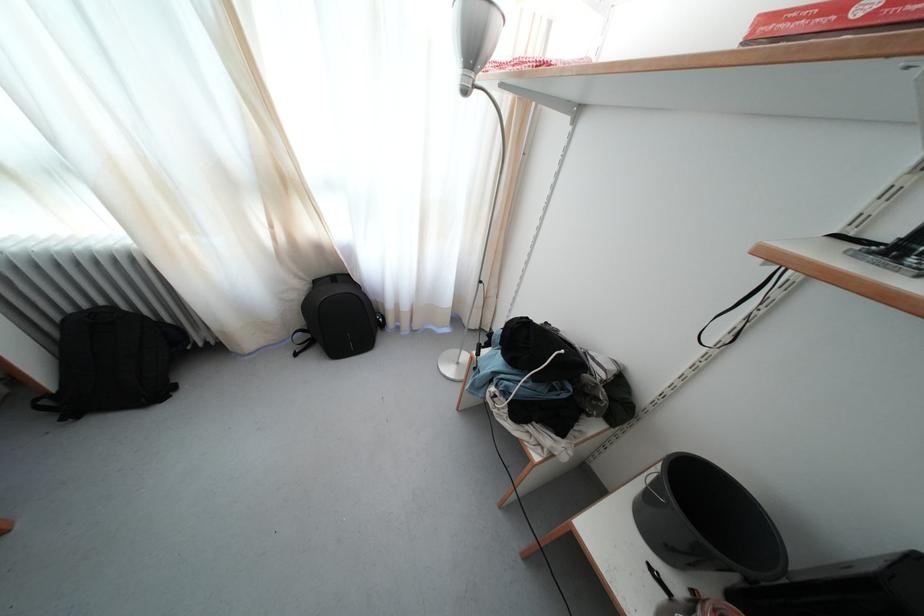
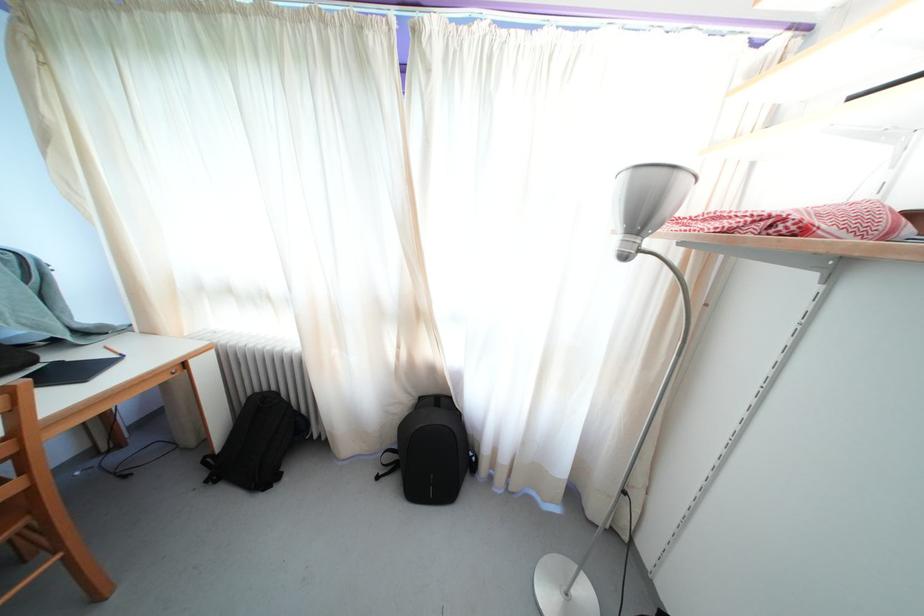
Where in the second image is the point corresponding to (x=288, y=188) from the first image?

(421, 321)